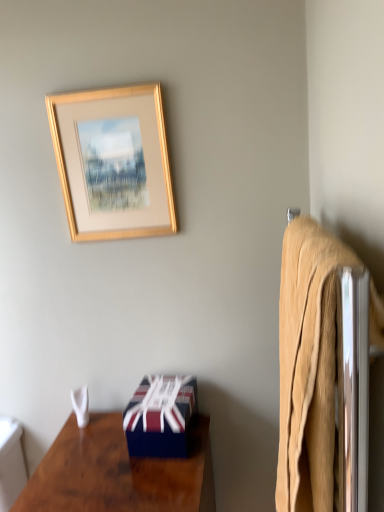
Where is `empty space that is ontop of blue glossy box at lower center`? Image resolution: width=384 pixels, height=512 pixels. empty space that is ontop of blue glossy box at lower center is located at coordinates (161, 387).